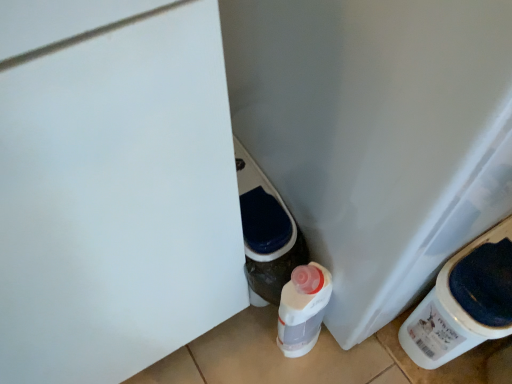
Image resolution: width=512 pixels, height=384 pixels. I want to click on white plastic water cooler at lower right, so click(377, 134).

The image size is (512, 384). What do you see at coordinates (377, 134) in the screenshot? I see `white plastic water cooler at lower right` at bounding box center [377, 134].

Describe the element at coordinates (113, 188) in the screenshot. The width and height of the screenshot is (512, 384). I see `white matte door at center` at that location.

Identify the location of white matte door at center. The height and width of the screenshot is (384, 512). (113, 188).

Identify the location of white plastic water cooler at lower right. Image resolution: width=512 pixels, height=384 pixels. (377, 134).

Which object is positioned more to the right, white plastic water cooler at lower right or white matte door at center?

white plastic water cooler at lower right is more to the right.

In the scene shown: Is white plastic water cooler at lower right in front of or behind white matte door at center in the image?

white plastic water cooler at lower right is positioned farther from the viewer than white matte door at center.

Is point (420, 56) farther from viewer compared to point (192, 126)?

No.

From the image's perspective, does white plastic water cooler at lower right appear higher than white matte door at center?

Yes, from the image's perspective, white plastic water cooler at lower right is on top of white matte door at center.

From a real-world perspective, is white plastic water cooler at lower right below white matte door at center?

Actually, white plastic water cooler at lower right is physically above white matte door at center in the real world.

Which of these two, white plastic water cooler at lower right or white matte door at center, is wider?

With larger width is white plastic water cooler at lower right.

Can you confirm if white plastic water cooler at lower right is taller than white matte door at center?

No.

Based on the photo, based on their sizes in the image, would you say white plastic water cooler at lower right is bigger or smaller than white matte door at center?

Considering their sizes, white plastic water cooler at lower right takes up more space than white matte door at center.

Is white plastic water cooler at lower right outside of white matte door at center?

Absolutely, white plastic water cooler at lower right is external to white matte door at center.

Are white plastic water cooler at lower right and white matte door at center located far from each other?

No, white plastic water cooler at lower right is not far away from white matte door at center.

Is white plastic water cooler at lower right oriented away from white matte door at center?

That's not correct — white plastic water cooler at lower right is not looking away from white matte door at center.

Can you tell me how much white plastic water cooler at lower right and white matte door at center differ in facing direction?

The angle between the facing direction of white plastic water cooler at lower right and the facing direction of white matte door at center is 90.4 degrees.

There is a white matte door at center. Where is `water cooler above it (from a real-world perspective)`? The height and width of the screenshot is (384, 512). water cooler above it (from a real-world perspective) is located at coordinates (377, 134).

Would you say white matte door at center is to the left or to the right of white plastic water cooler at lower right in the picture?

Clearly, white matte door at center is on the left of white plastic water cooler at lower right in the image.

Considering their positions, is white matte door at center located in front of or behind white plastic water cooler at lower right?

white matte door at center is positioned closer to the viewer than white plastic water cooler at lower right.

Is point (60, 22) behind point (386, 184)?

That is False.

From the image's perspective, is white matte door at center above white plastic water cooler at lower right?

No, from the image's perspective, white matte door at center is not over white plastic water cooler at lower right.

From a real-world perspective, which is physically below, white matte door at center or white plastic water cooler at lower right?

From a 3D spatial view, white matte door at center is below.

Based on the photo, is white matte door at center thinner than white plastic water cooler at lower right?

Correct, the width of white matte door at center is less than that of white plastic water cooler at lower right.

Looking at this image, considering the relative sizes of white matte door at center and white plastic water cooler at lower right in the image provided, is white matte door at center shorter than white plastic water cooler at lower right?

No.

Who is smaller, white matte door at center or white plastic water cooler at lower right?

white matte door at center is smaller.

Is white plastic water cooler at lower right a part of white matte door at center?

No, white plastic water cooler at lower right is not a part of white matte door at center.

From the picture: Is white matte door at center directly adjacent to white plastic water cooler at lower right?

No, white matte door at center is not next to white plastic water cooler at lower right.

Looking at this image, is white matte door at center positioned with its back to white plastic water cooler at lower right?

white matte door at center is not turned away from white plastic water cooler at lower right.

How different are the orientations of white matte door at center and white plastic water cooler at lower right in degrees?

They differ by 90.4 degrees in their facing directions.

Find the location of a particular element. The image size is (512, 384). door that appears on the left of white plastic water cooler at lower right is located at coordinates (113, 188).

Where is `water cooler located behind the white matte door at center`? water cooler located behind the white matte door at center is located at coordinates (377, 134).

Identify the location of door below the white plastic water cooler at lower right (from the image's perspective). This screenshot has height=384, width=512. (113, 188).